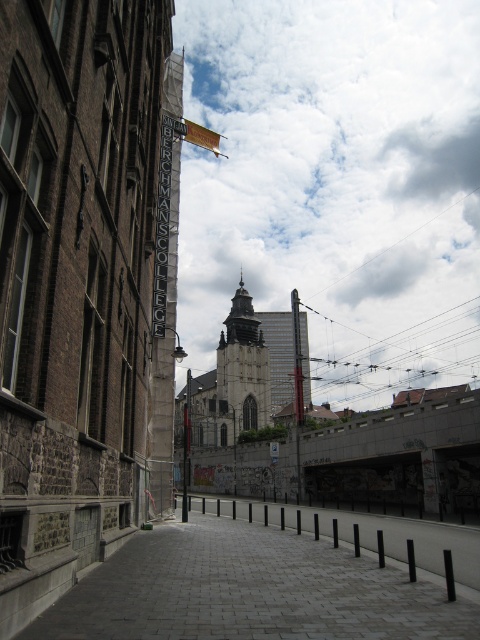
You are an architect analyzing the urban scene. You notice the cloudy sky at upper center and the silver metallic sign at center. Which of these two elements occupies a greater horizontal space in the image?

The cloudy sky at upper center occupies a greater horizontal space than the silver metallic sign at center because its width is larger according to the description.

Please provide the 2D coordinates of the cloudy sky at upper center in the image. The coordinates should be in the format of a point with two decimal places, like this example format point format. Please do not add any extra text or explanation.

The 2D coordinates of the cloudy sky at upper center are point (336, 186).

You are an architect analyzing the urban skyline. Given the cloudy sky at upper center and the silver metallic sign at center, which one occupies more visual space in the scene?

The cloudy sky at upper center is larger in size than the silver metallic sign at center, so it occupies more visual space in the scene.